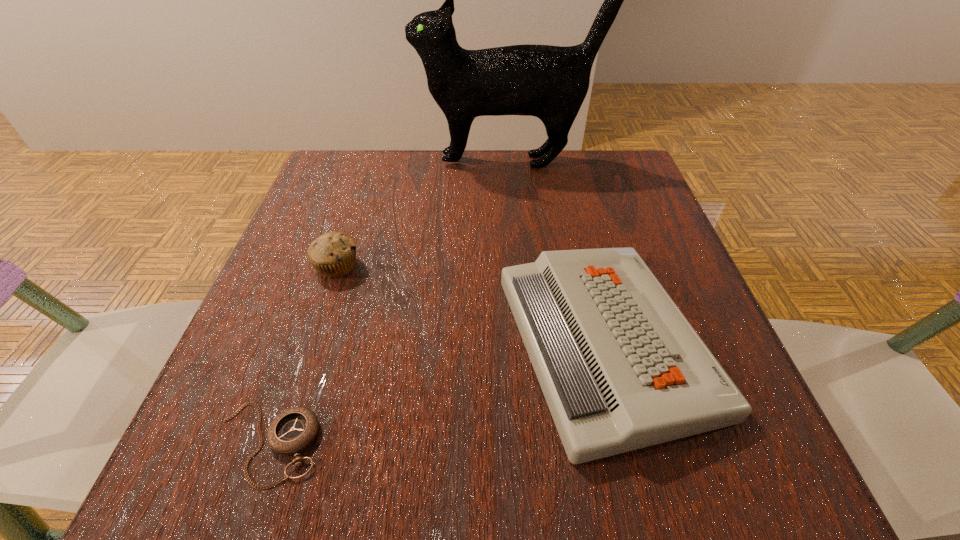
Find the location of a particular element. The height and width of the screenshot is (540, 960). computer keyboard that is at the near edge is located at coordinates (621, 368).

The width and height of the screenshot is (960, 540). Identify the location of pocket watch that is at the near edge. (293, 430).

You are a GUI agent. You are given a task and a screenshot of the screen. Output one action in this format:
    pyautogui.click(x=<x>, y=<y>)
    Task: Click on the muffin that is positioned at the left edge
    This screenshot has height=540, width=960.
    Given the screenshot: What is the action you would take?
    pyautogui.click(x=333, y=254)

What are the coordinates of `pocket watch that is at the left edge` in the screenshot? It's located at point(293,430).

At what (x,y) coordinates should I click in order to perform the action: click on cat at the right edge. Please return your answer as a coordinate pair (x, y). The height and width of the screenshot is (540, 960). Looking at the image, I should click on (550, 82).

Where is `computer keyboard that is positioned at the right edge`? This screenshot has width=960, height=540. computer keyboard that is positioned at the right edge is located at coordinates (621, 368).

Identify the location of object present at the near left corner. (293, 430).

You are a GUI agent. You are given a task and a screenshot of the screen. Output one action in this format:
    pyautogui.click(x=<x>, y=<y>)
    Task: Click on the object that is positioned at the far right corner
    The width and height of the screenshot is (960, 540).
    Given the screenshot: What is the action you would take?
    pyautogui.click(x=550, y=82)

The width and height of the screenshot is (960, 540). Identify the location of object that is at the near right corner. (621, 368).

Identify the location of free region at the far edge of the desktop. (398, 160).